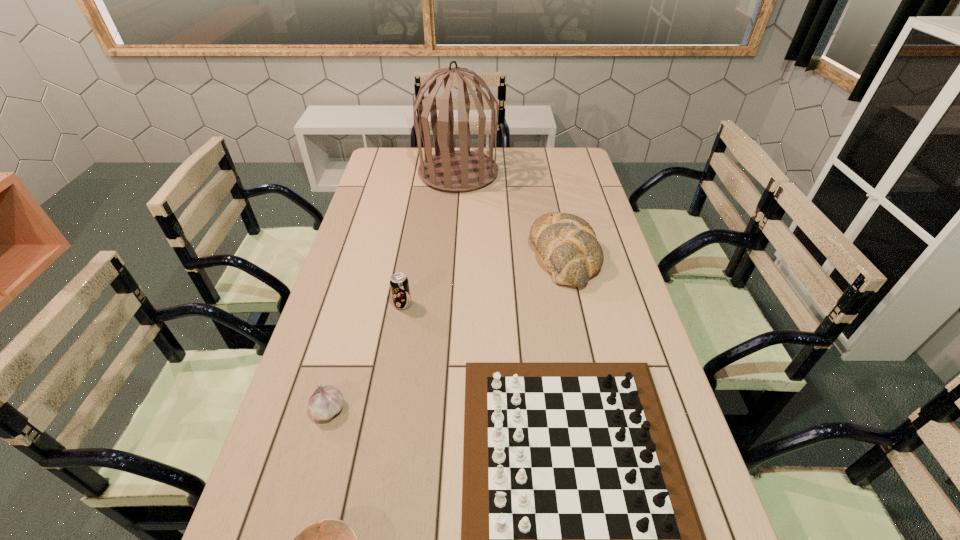
Image resolution: width=960 pixels, height=540 pixels. What are the coordinates of `the farthest object` in the screenshot? It's located at (450, 170).

This screenshot has width=960, height=540. I want to click on birdcage, so click(x=450, y=170).

Find the location of a particular element. bread is located at coordinates (567, 246).

The width and height of the screenshot is (960, 540). I want to click on the fourth nearest object, so click(399, 284).

Find the location of `garlic`. garlic is located at coordinates (325, 402).

I want to click on vacant region located 0.310m on the front of the birdcage, so click(453, 244).

Identify the location of vacant area located on the left of the bread. (459, 255).

Image resolution: width=960 pixels, height=540 pixels. In order to click on free space located on the right of the soda can in this screenshot , I will do `click(428, 305)`.

Find the location of a particular element. The height and width of the screenshot is (540, 960). vacant position located on the back of the garlic is located at coordinates (354, 318).

Find the location of a particular element. object at the far edge is located at coordinates coord(450,170).